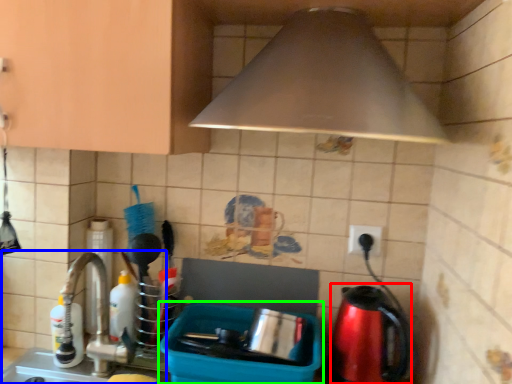
Question: Based on their relative distances, which object is farther from coffeepot (highlighted by a red box)? Choose from sink (highlighted by a blue box) and appliance (highlighted by a green box).

Choices:
 (A) sink
 (B) appliance

Answer: (A)